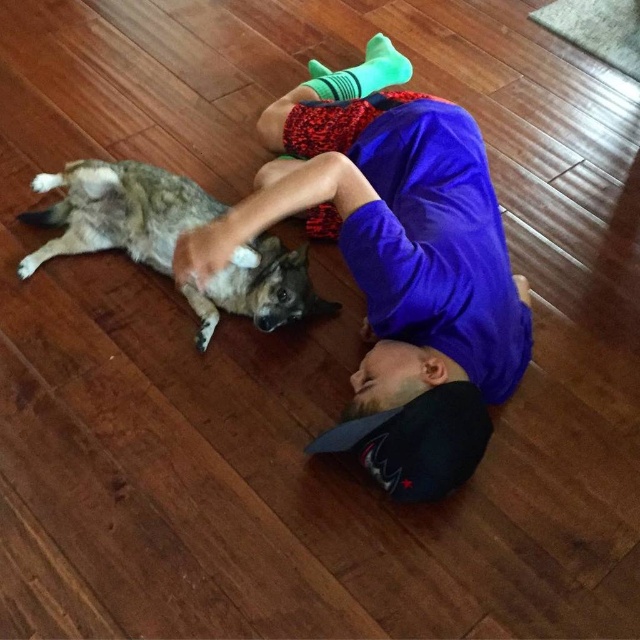
Can you confirm if purple cotton shirt at center is bigger than brown fur dog at upper left?

Indeed, purple cotton shirt at center has a larger size compared to brown fur dog at upper left.

Is point (273, 140) positioned in front of point (83, 189)?

That is False.

Locate an element on the screen. purple cotton shirt at center is located at coordinates (396, 259).